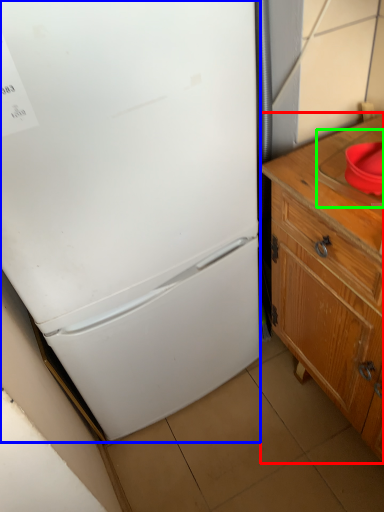
Question: Considering the real-world distances, which object is closest to cabinetry (highlighted by a red box)? refrigerator (highlighted by a blue box) or sink (highlighted by a green box).

Choices:
 (A) refrigerator
 (B) sink

Answer: (B)